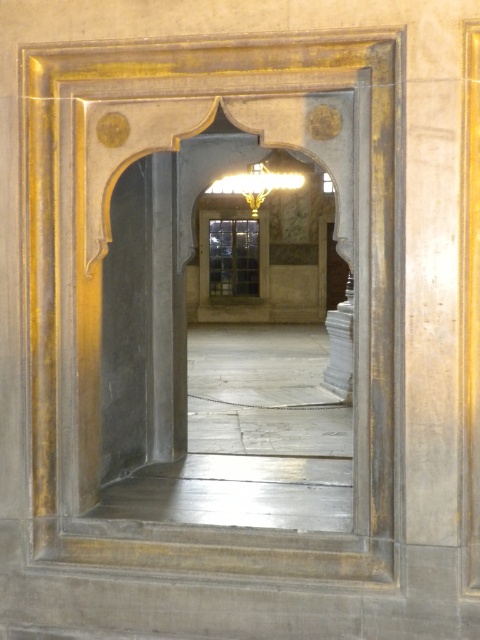
Question: Is gold polished stone archway at center below gold metallic chandelier at center?

Choices:
 (A) no
 (B) yes

Answer: (B)

Question: Does gold polished stone archway at center have a lesser width compared to gold metallic chandelier at center?

Choices:
 (A) no
 (B) yes

Answer: (A)

Question: Which object appears closest to the camera in this image?

Choices:
 (A) gold polished stone archway at center
 (B) gold metallic chandelier at center

Answer: (A)

Question: Does gold polished stone archway at center appear under gold metallic chandelier at center?

Choices:
 (A) no
 (B) yes

Answer: (B)

Question: Among these objects, which one is farthest from the camera?

Choices:
 (A) gold metallic chandelier at center
 (B) gold polished stone archway at center

Answer: (A)